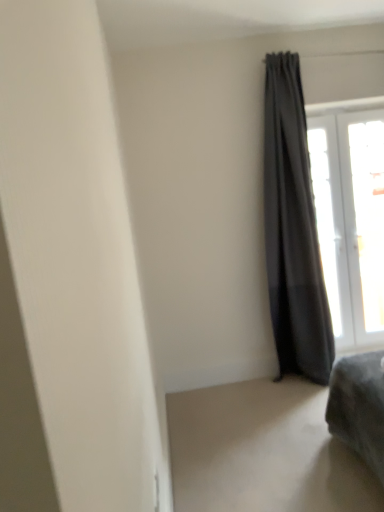
Locate an element on the screen. The width and height of the screenshot is (384, 512). vacant space underneath dark gray fabric curtain at right (from a real-world perspective) is located at coordinates (299, 380).